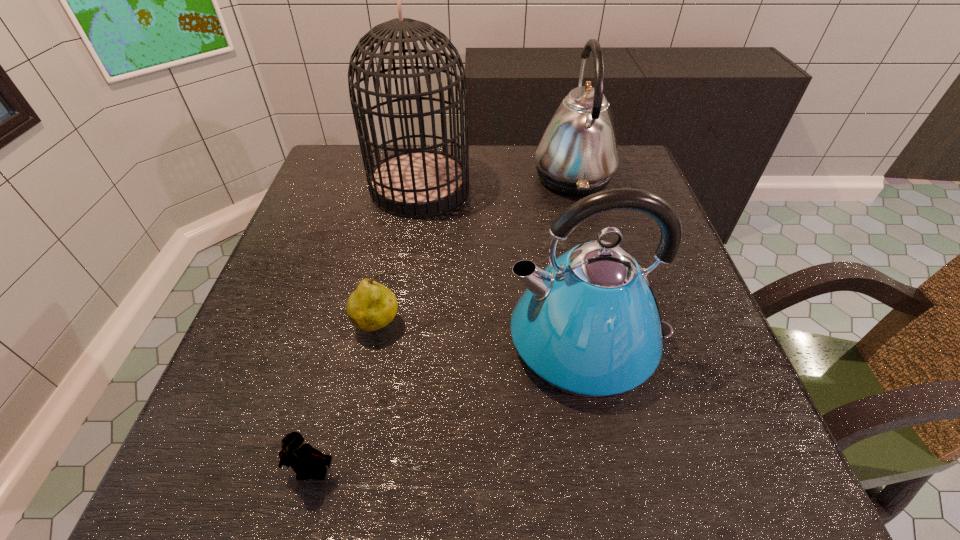
Locate an element on the screen. This screenshot has height=540, width=960. vacant area between the pear and the nearest object is located at coordinates (346, 399).

Where is `vacant region between the tallest object and the fourth tallest object`? This screenshot has width=960, height=540. vacant region between the tallest object and the fourth tallest object is located at coordinates (399, 257).

Where is `vacant space that's between the pear and the birdcage`? The height and width of the screenshot is (540, 960). vacant space that's between the pear and the birdcage is located at coordinates (399, 257).

Locate an element on the screen. free space between the farther kettle and the pear is located at coordinates (475, 251).

At what (x,y) coordinates should I click in order to perform the action: click on vacant area that lies between the nearest object and the nearer kettle. Please return your answer as a coordinate pair (x, y). The height and width of the screenshot is (540, 960). Looking at the image, I should click on click(x=449, y=407).

Where is `free space between the tallest object and the farther kettle`? This screenshot has height=540, width=960. free space between the tallest object and the farther kettle is located at coordinates (496, 182).

Identify the location of vacant point located between the nearer kettle and the fourth tallest object. (483, 334).

Image resolution: width=960 pixels, height=540 pixels. What are the coordinates of `vacant area between the nearest object and the second shortest object` in the screenshot? It's located at (346, 399).

Where is `blank region between the tallest object and the second shortest object`? The width and height of the screenshot is (960, 540). blank region between the tallest object and the second shortest object is located at coordinates (399, 257).

At what (x,y) coordinates should I click in order to perform the action: click on the second closest object to the Lego. Please return your answer as a coordinate pair (x, y). The image size is (960, 540). Looking at the image, I should click on (588, 324).